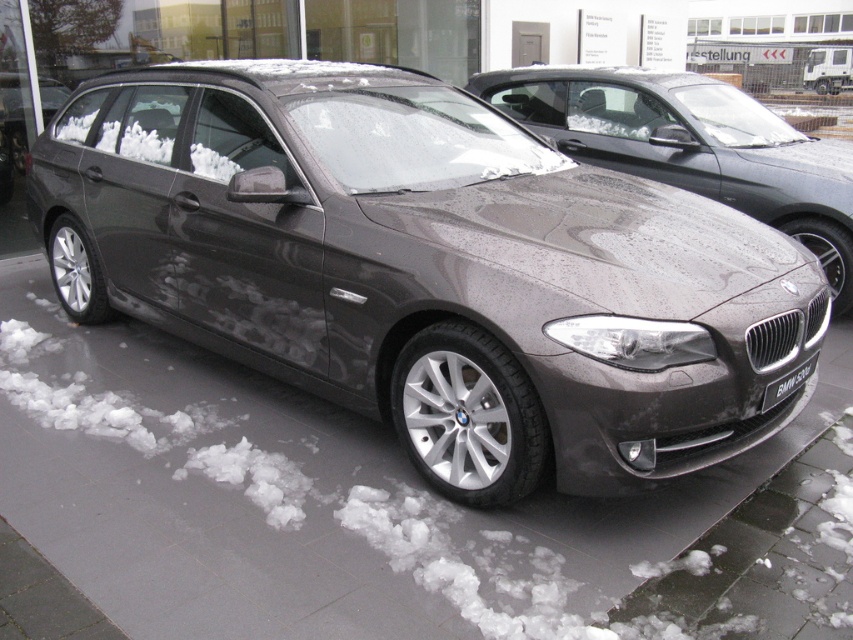
Describe the element at coordinates (427, 269) in the screenshot. I see `satin metallic car at center` at that location.

Does point (271, 234) lie in front of point (669, 97)?

Yes.

What do you see at coordinates (427, 269) in the screenshot? I see `satin metallic car at center` at bounding box center [427, 269].

This screenshot has height=640, width=853. Find the location of `satin metallic car at center`. satin metallic car at center is located at coordinates (427, 269).

Who is shorter, satin metallic sedan at center or black plastic license plate at center?

Standing shorter between the two is black plastic license plate at center.

Based on the photo, who is more forward, [543,129] or [793,376]?

Positioned in front is point [793,376].

At what (x,y) coordinates should I click in order to perform the action: click on satin metallic sedan at center. Please return your answer as a coordinate pair (x, y). Looking at the image, I should click on (692, 147).

Is satin metallic car at center shorter than black plastic license plate at center?

Incorrect, satin metallic car at center's height does not fall short of black plastic license plate at center's.

Is satin metallic car at center above black plastic license plate at center?

Correct, satin metallic car at center is located above black plastic license plate at center.

Image resolution: width=853 pixels, height=640 pixels. What do you see at coordinates (427, 269) in the screenshot?
I see `satin metallic car at center` at bounding box center [427, 269].

Where is `satin metallic car at center`? satin metallic car at center is located at coordinates (427, 269).